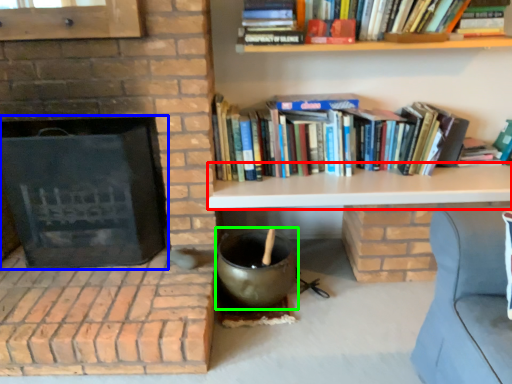
Question: Which object is the closest to the table (highlighted by a red box)? Choose among these: fireplace (highlighted by a blue box) or wok (highlighted by a green box).

Choices:
 (A) fireplace
 (B) wok

Answer: (B)